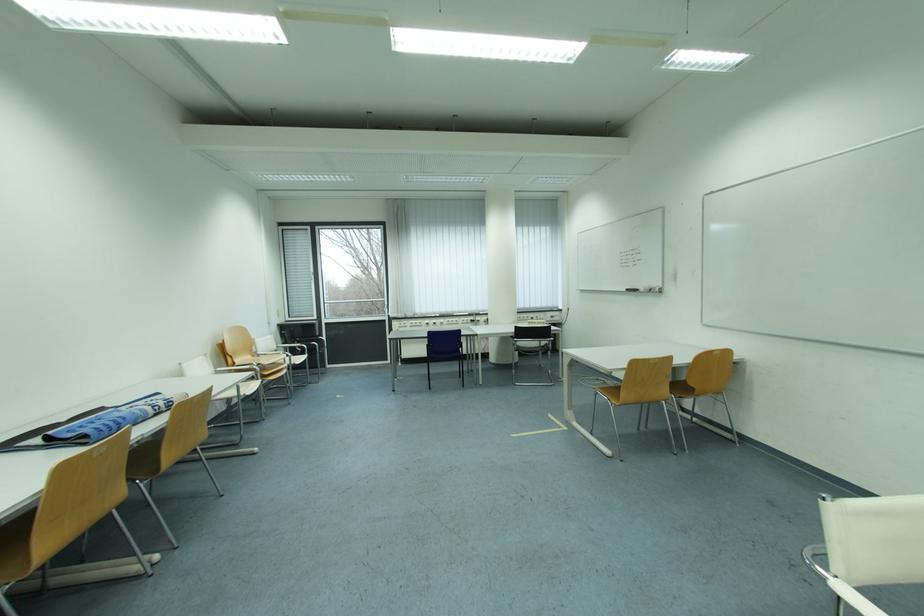
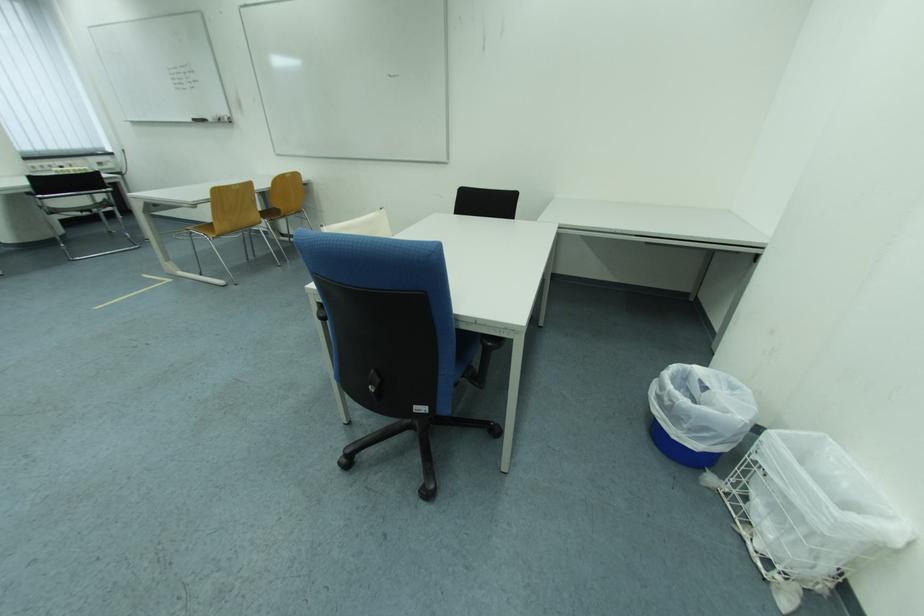
The point at (687, 382) is marked in the first image. Where is the corresponding point in the second image?

(277, 211)